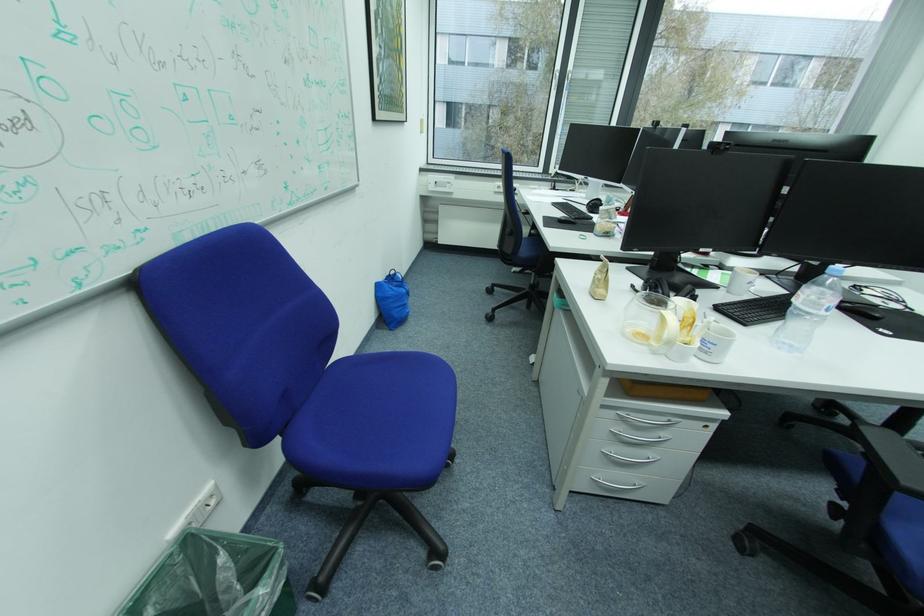
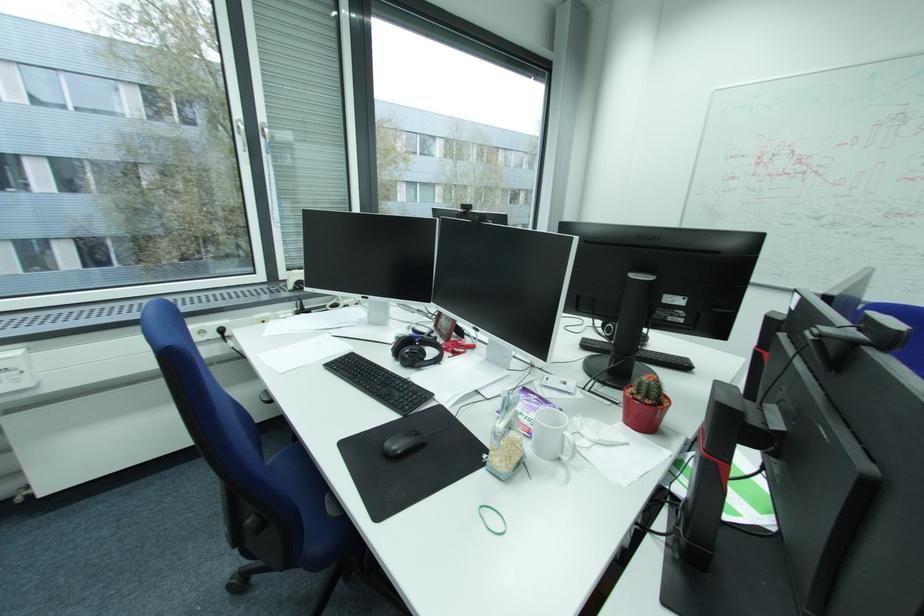
The point at (603, 211) is marked in the first image. Where is the corresponding point in the second image?

(427, 365)